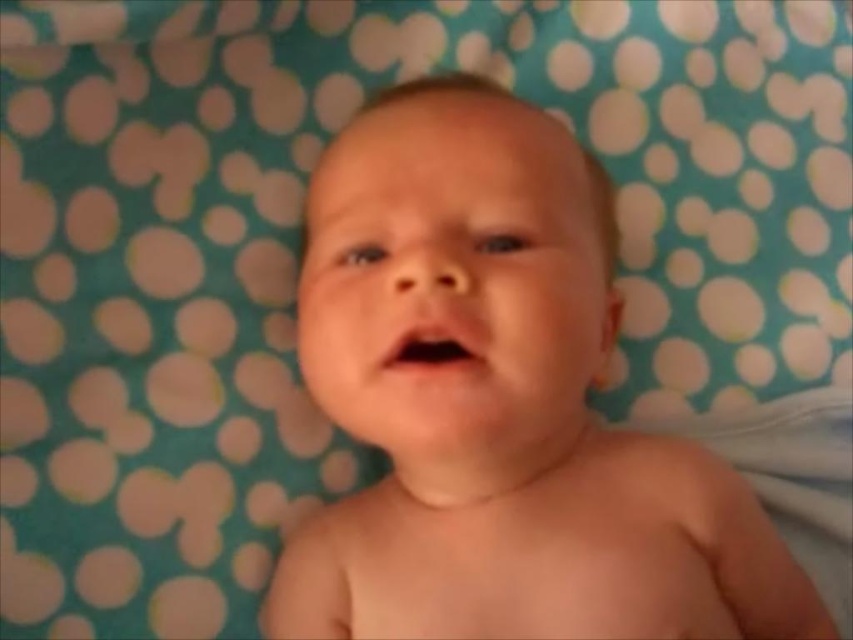
You are a photographer adjusting the camera focus. The subject is the smooth skin baby at center and the pink smooth mouth at center. Which part should you focus on first if you want to ensure the baby is clearly visible?

The smooth skin baby at center is located below the pink smooth mouth at center, so you should focus on the pink smooth mouth at center first to ensure the baby is clearly visible.

In the image of the baby lying on the patterned fabric, which object is wider between the smooth skin baby at center and the pink smooth mouth at center?

The smooth skin baby at center is wider than the pink smooth mouth at center.

You are a photographer taking a closeup shot of the baby. You need to ensure that both the smooth skin baby at center and the pink smooth mouth at center are in focus. Given that your camera can only focus on one object at a time, which object should you prioritize focusing on to ensure the other remains in focus due to its size?

The smooth skin baby at center is larger in size than the pink smooth mouth at center. Therefore, focusing on the smooth skin baby at center would ensure the pink smooth mouth at center stays in focus as it is smaller and within the depth of field.